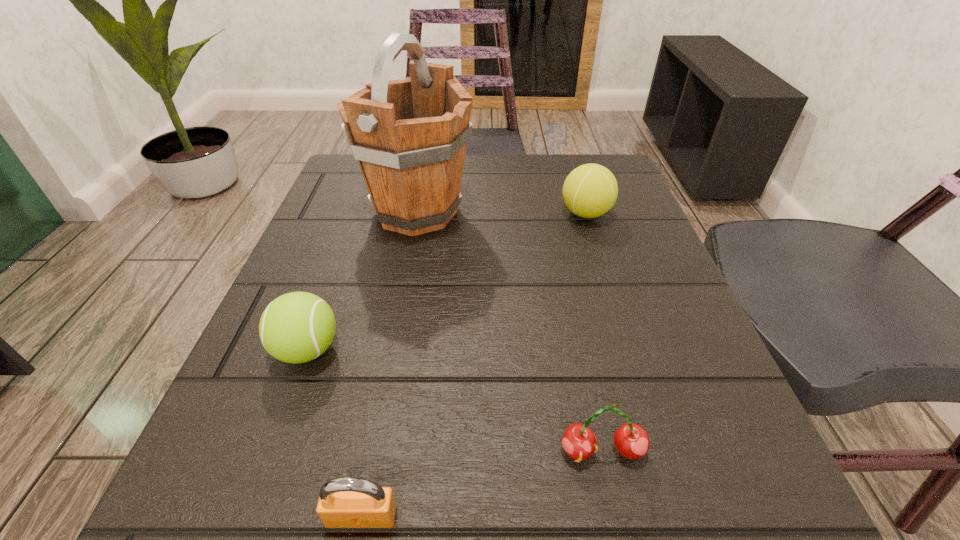
Locate an element on the screen. This screenshot has height=540, width=960. object located at the far right corner is located at coordinates (590, 190).

Locate an element on the screen. The height and width of the screenshot is (540, 960). object at the near right corner is located at coordinates (631, 440).

The image size is (960, 540). In order to click on free space at the far edge of the desktop in this screenshot , I will do `click(505, 154)`.

What are the coordinates of `vacant space at the near edge of the desktop` in the screenshot? It's located at (472, 463).

You are a GUI agent. You are given a task and a screenshot of the screen. Output one action in this format:
    pyautogui.click(x=<x>, y=<y>)
    Task: Click on the free space at the left edge
    
    Given the screenshot: What is the action you would take?
    pyautogui.click(x=291, y=263)

The height and width of the screenshot is (540, 960). What are the coordinates of `blank space at the right edge of the desktop` in the screenshot? It's located at (584, 228).

You are a GUI agent. You are given a task and a screenshot of the screen. Output one action in this format:
    pyautogui.click(x=<x>, y=<y>)
    Task: Click on the vacant space at the far left corner
    
    Given the screenshot: What is the action you would take?
    pyautogui.click(x=333, y=200)

This screenshot has height=540, width=960. In order to click on free space at the far right corner of the desktop in this screenshot , I will do `click(619, 207)`.

Locate an element on the screen. vacant space at the near right corner is located at coordinates (709, 496).

You are a GUI agent. You are given a task and a screenshot of the screen. Output one action in this format:
    pyautogui.click(x=<x>, y=<y>)
    Task: Click on the free space between the right tennis ball and the bucket
    
    Given the screenshot: What is the action you would take?
    pyautogui.click(x=501, y=213)